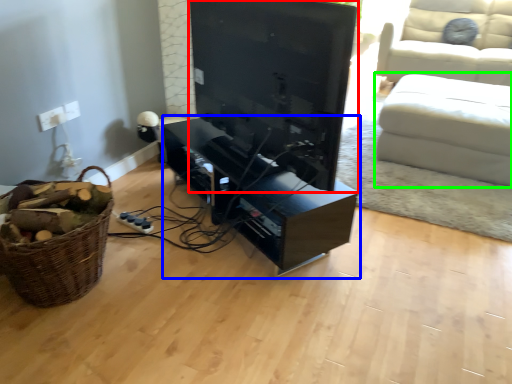
Question: Which object is the farthest from television (highlighted by a red box)? Choose among these: entertainment center (highlighted by a blue box) or studio couch (highlighted by a green box).

Choices:
 (A) entertainment center
 (B) studio couch

Answer: (B)